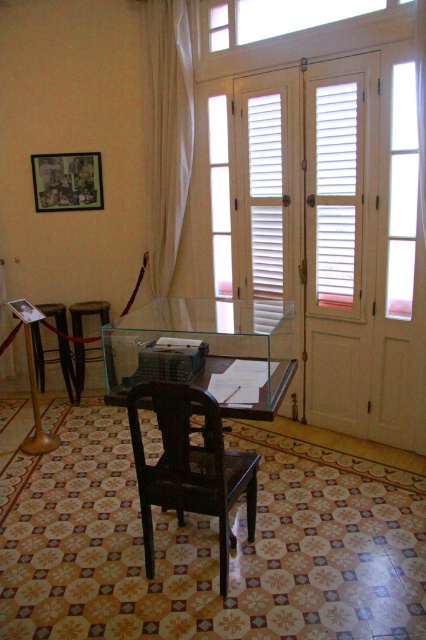
You are a visitor in the museum and want to sit on the wooden stool at center to examine the typewriter. Can you sit there without moving the transparent glass table at center?

The transparent glass table at center is in front of the wooden stool at center, so you would need to move the table to access the stool. Therefore, you cannot sit there without moving the table.

You are an interior designer planning to place a new rug in this room. The rug must fit under both the transparent glass table at center and the wooden stool at center. Given that the rug is circular, which object will require the rug to have a larger diameter to accommodate it?

The transparent glass table at center requires the rug to have a larger diameter because it is bigger than the wooden stool at center.